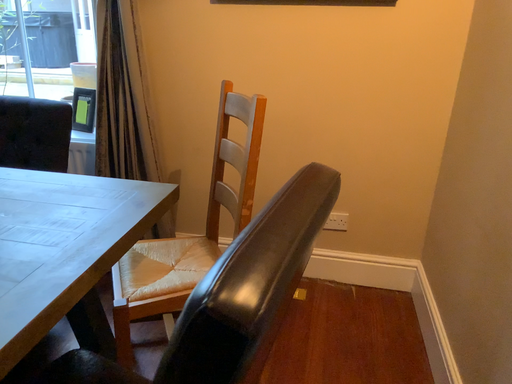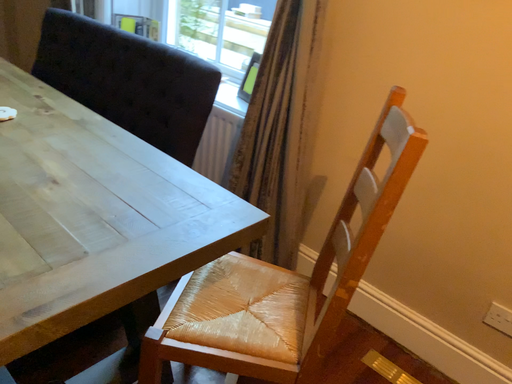
Question: Which way did the camera rotate in the video?

Choices:
 (A) rotated left
 (B) rotated right

Answer: (A)